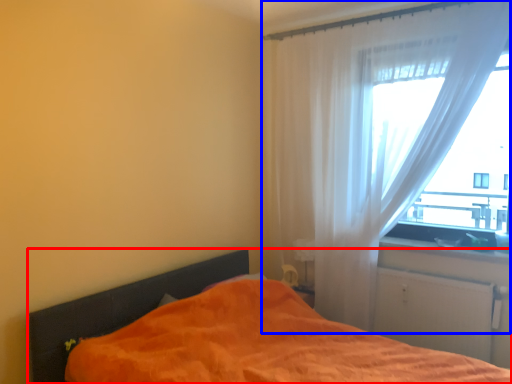
Question: Which object is further to the camera taking this photo, bed (highlighted by a red box) or curtain (highlighted by a blue box)?

Choices:
 (A) bed
 (B) curtain

Answer: (B)